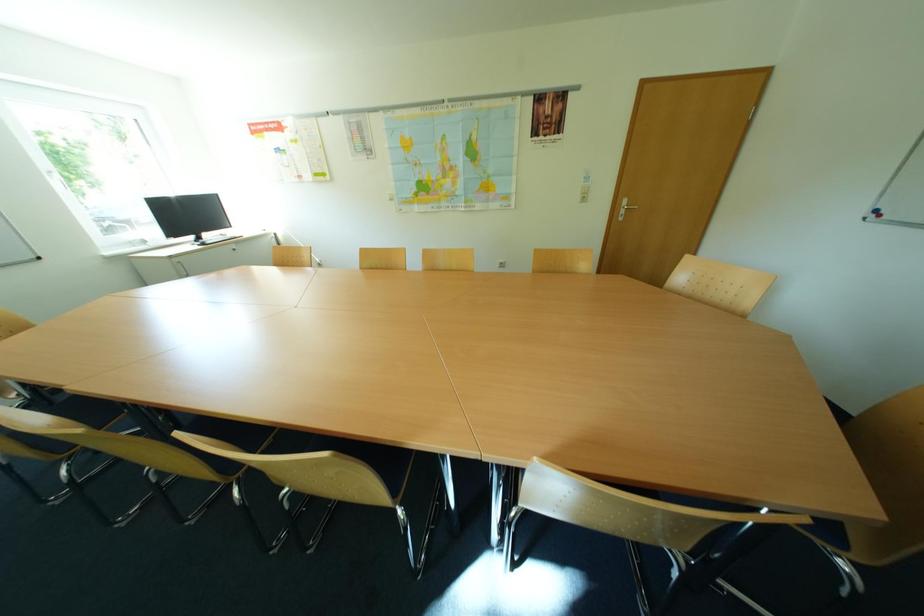
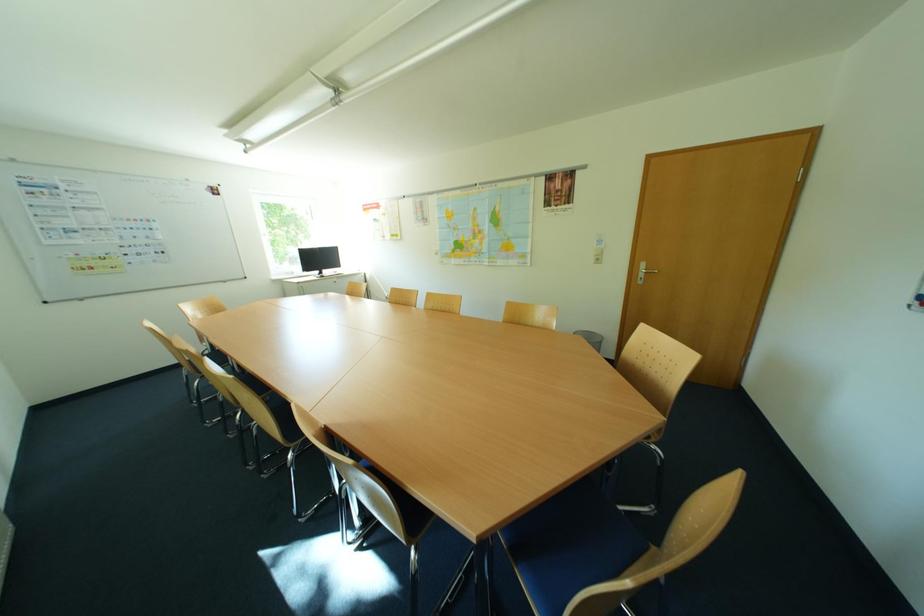
Question: Based on the continuous images, in which direction is the camera rotating? Reply with the corresponding letter.

Choices:
 (A) Left
 (B) Right
 (C) Up
 (D) Down

Answer: (A)